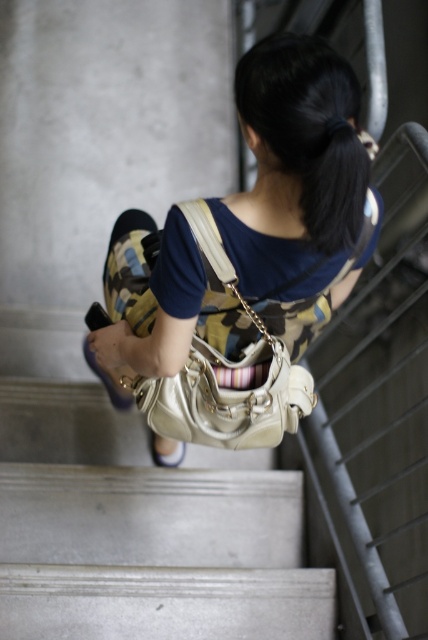
Question: Is matte beige purse at center to the left of matte beige shoulder bag at center from the viewer's perspective?

Choices:
 (A) no
 (B) yes

Answer: (A)

Question: Can you confirm if matte beige shoulder bag at center is positioned above white fabric sandal at lower center?

Choices:
 (A) no
 (B) yes

Answer: (B)

Question: Can you confirm if matte beige purse at center is smaller than white fabric sandal at lower center?

Choices:
 (A) no
 (B) yes

Answer: (A)

Question: Among these objects, which one is nearest to the camera?

Choices:
 (A) white fabric sandal at lower center
 (B) matte beige purse at center

Answer: (B)

Question: Estimate the real-world distances between objects in this image. Which object is farther from the white fabric sandal at lower center?

Choices:
 (A) matte beige shoulder bag at center
 (B) matte beige purse at center

Answer: (B)

Question: Which point is closer to the camera?

Choices:
 (A) (155, 356)
 (B) (317, 305)
 (C) (174, 465)

Answer: (A)